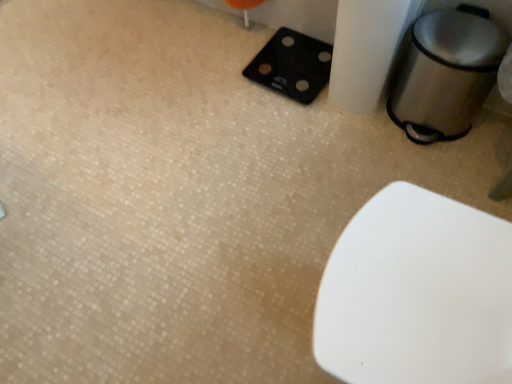
Identify the location of polished stainless steel trash can at right. (446, 73).

Describe the element at coordinates (446, 73) in the screenshot. I see `polished stainless steel trash can at right` at that location.

Where is `polished stainless steel trash can at right`? polished stainless steel trash can at right is located at coordinates (446, 73).